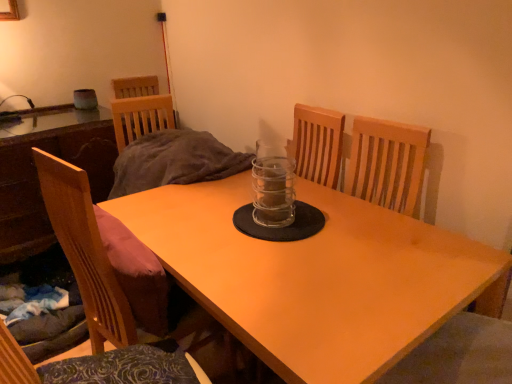
Question: Is wooden table at left, the first table in the left-to-right sequence, thinner than light brown wooden table at center, the first table from the right?

Choices:
 (A) yes
 (B) no

Answer: (A)

Question: Considering the relative sizes of wooden table at left, which is the second table in right-to-left order, and light brown wooden table at center, which is the second table from left to right, in the image provided, is wooden table at left, which is the second table in right-to-left order, wider than light brown wooden table at center, which is the second table from left to right,?

Choices:
 (A) no
 (B) yes

Answer: (A)

Question: Is wooden table at left, which is the second table in right-to-left order, positioned behind light brown wooden table at center, which is the second table from left to right?

Choices:
 (A) yes
 (B) no

Answer: (A)

Question: Is wooden table at left, which is the second table in right-to-left order, to the right of light brown wooden table at center, the first table from the right, from the viewer's perspective?

Choices:
 (A) yes
 (B) no

Answer: (B)

Question: Is wooden table at left, which is the second table in right-to-left order, not within light brown wooden table at center, the first table from the right?

Choices:
 (A) yes
 (B) no

Answer: (A)

Question: Considering the positions of point (270, 331) and point (254, 173), is point (270, 331) closer or farther from the camera than point (254, 173)?

Choices:
 (A) closer
 (B) farther

Answer: (A)

Question: Is light brown wooden table at center, the first table from the right, inside the boundaries of transparent glass jar at center, or outside?

Choices:
 (A) outside
 (B) inside

Answer: (A)

Question: From the image's perspective, relative to transparent glass jar at center, is light brown wooden table at center, which is the second table from left to right, above or below?

Choices:
 (A) above
 (B) below

Answer: (B)

Question: In terms of width, does light brown wooden table at center, the first table from the right, look wider or thinner when compared to transparent glass jar at center?

Choices:
 (A) thin
 (B) wide

Answer: (B)

Question: Considering the positions of transparent glass jar at center and wooden chair at left in the image, is transparent glass jar at center wider or thinner than wooden chair at left?

Choices:
 (A) thin
 (B) wide

Answer: (A)

Question: From their relative heights in the image, would you say transparent glass jar at center is taller or shorter than wooden chair at left?

Choices:
 (A) short
 (B) tall

Answer: (A)

Question: Is transparent glass jar at center bigger or smaller than wooden chair at left?

Choices:
 (A) big
 (B) small

Answer: (B)

Question: From a real-world perspective, is transparent glass jar at center physically located above or below wooden chair at left?

Choices:
 (A) below
 (B) above

Answer: (B)

Question: In terms of size, does wooden table at left, the first table in the left-to-right sequence, appear bigger or smaller than wooden chair at left?

Choices:
 (A) small
 (B) big

Answer: (B)

Question: Is wooden table at left, the first table in the left-to-right sequence, taller or shorter than wooden chair at left?

Choices:
 (A) short
 (B) tall

Answer: (A)